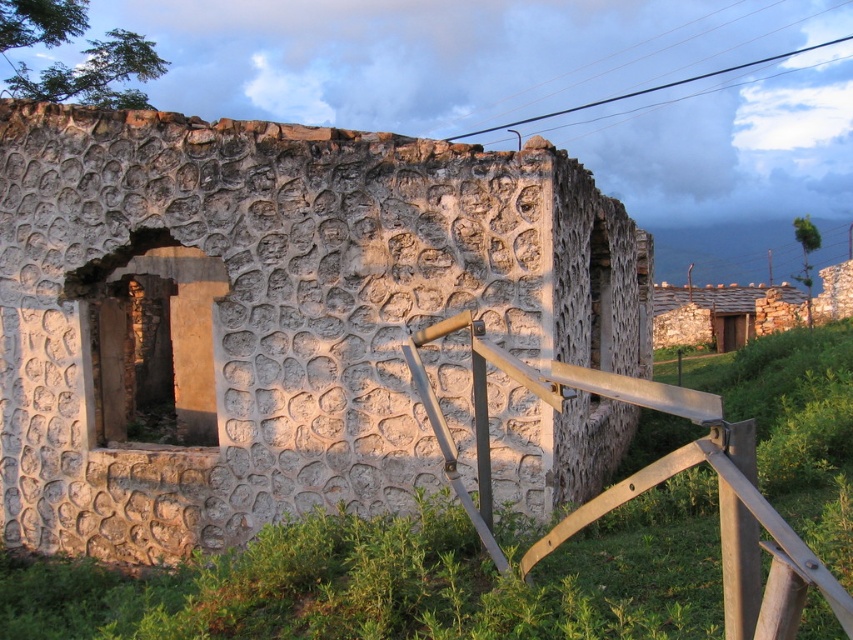
Is point (315, 129) in front of point (659, 342)?

Yes.

Who is more forward, (451, 401) or (701, 307)?

Point (451, 401)

You are a GUI agent. You are given a task and a screenshot of the screen. Output one action in this format:
    pyautogui.click(x=<x>, y=<y>)
    Task: Click on the rough stone wall at center
    
    Given the screenshot: What is the action you would take?
    pyautogui.click(x=273, y=312)

Is point (560, 486) less distant than point (451, 321)?

No, it is behind (451, 321).

How much distance is there between rough stone wall at center and metallic silver rail at lower right?

rough stone wall at center and metallic silver rail at lower right are 10.53 meters apart from each other.

Between point (526, 342) and point (436, 328), which one is positioned behind?

Positioned behind is point (526, 342).

At what (x,y) coordinates should I click in order to perform the action: click on rough stone wall at center. Please return your answer as a coordinate pair (x, y). Image resolution: width=853 pixels, height=640 pixels. Looking at the image, I should click on (273, 312).

Can you confirm if metallic silver rail at lower right is positioned to the left of stone roof hut at upper right?

Correct, you'll find metallic silver rail at lower right to the left of stone roof hut at upper right.

Between point (666, 388) and point (656, 285), which one is positioned behind?

The point (656, 285) is behind.

Does point (428, 396) come closer to viewer compared to point (660, 304)?

Yes, it is in front of point (660, 304).

At what (x,y) coordinates should I click in order to perform the action: click on metallic silver rail at lower right. Please return your answer as a coordinate pair (x, y). This screenshot has width=853, height=640. Looking at the image, I should click on (645, 483).